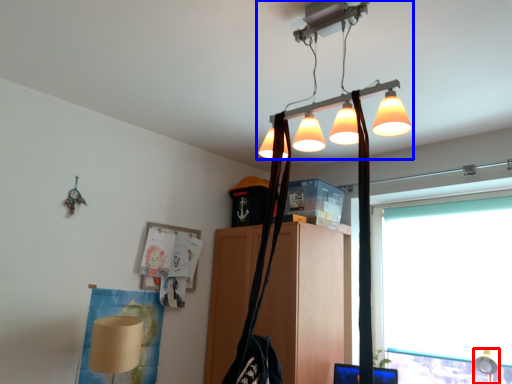
Question: Which object is further to the camera taking this photo, table lamp (highlighted by a red box) or lamp (highlighted by a blue box)?

Choices:
 (A) table lamp
 (B) lamp

Answer: (A)